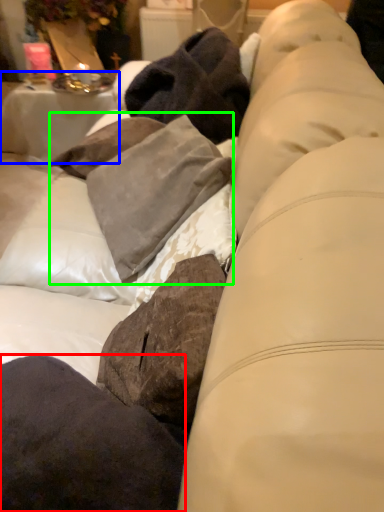
Question: Which object is the farthest from pillow (highlighted by a red box)? Choose among these: table (highlighted by a blue box) or clothing (highlighted by a green box).

Choices:
 (A) table
 (B) clothing

Answer: (A)